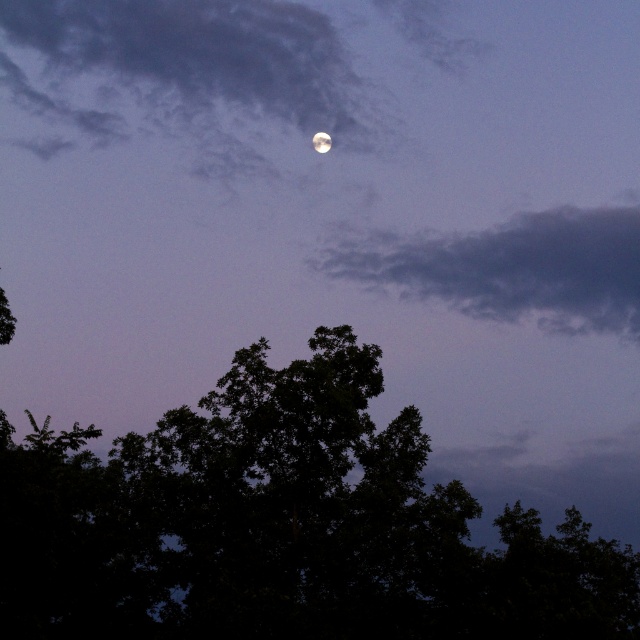
You are an astronomer observing the night sky. You notice the green leafy tree at center and the gray matte cloud at upper center. Which object is positioned higher in the sky?

The gray matte cloud at upper center is positioned higher in the sky than the green leafy tree at center.

You are an astronomer observing the night sky. You notice the cloudy sky at upper center and the gray matte cloud at upper center. Which one is positioned higher in the sky?

The cloudy sky at upper center is located above the gray matte cloud at upper center, so the cloudy sky at upper center is positioned higher.